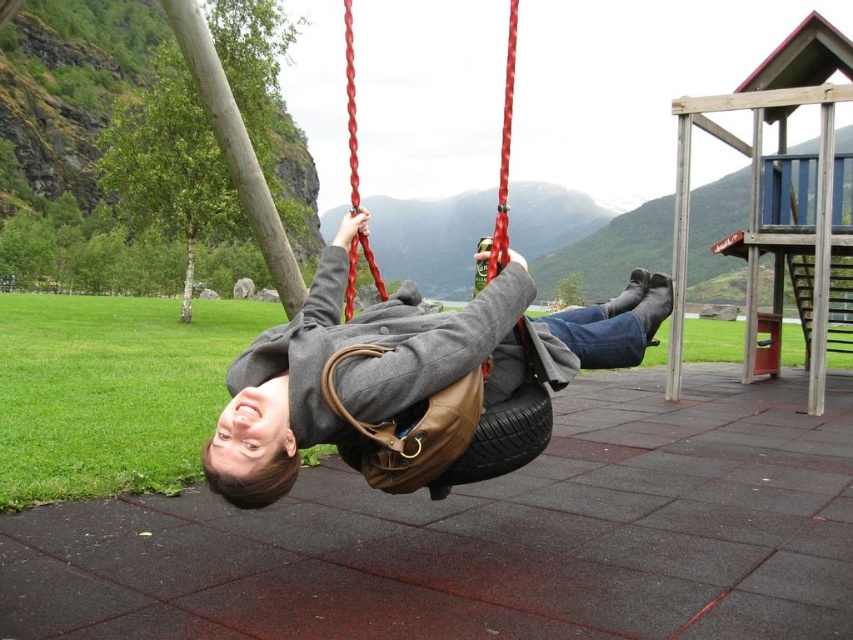
Question: Can you confirm if gray wool coat at center is wider than rubber tire swing at center?

Choices:
 (A) no
 (B) yes

Answer: (A)

Question: Which point is farther from the camera taking this photo?

Choices:
 (A) (473, 406)
 (B) (305, 435)

Answer: (A)

Question: Does gray wool coat at center have a smaller size compared to rubber tire swing at center?

Choices:
 (A) yes
 (B) no

Answer: (A)

Question: Which point appears farthest from the camera in this image?

Choices:
 (A) coord(531,339)
 (B) coord(474,378)

Answer: (A)

Question: Can you confirm if gray wool coat at center is wider than rubber tire swing at center?

Choices:
 (A) yes
 (B) no

Answer: (B)